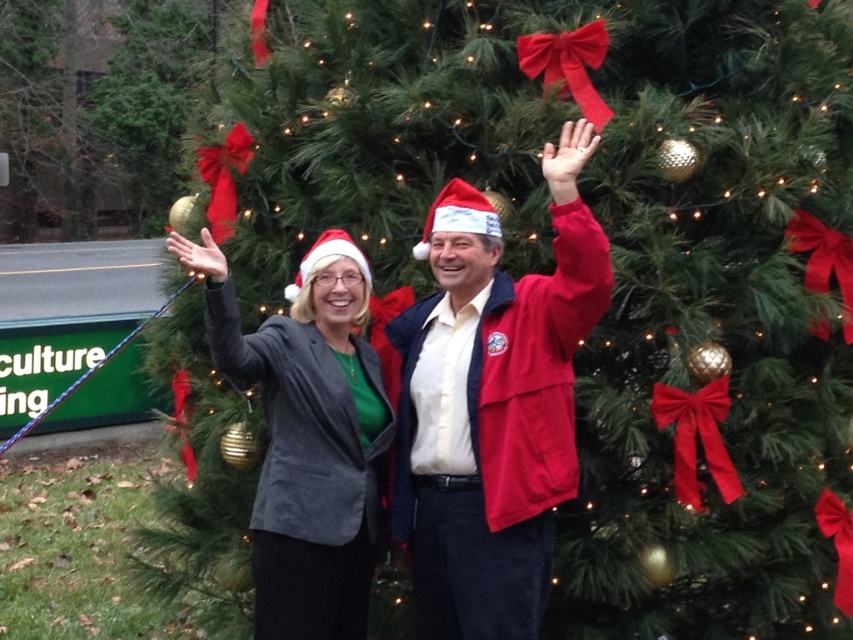
Between point (490, 525) and point (100, 88), which one is positioned in front?

Positioned in front is point (490, 525).

Is matte black blazer at center shorter than shiny gold ornament at left?

Correct, matte black blazer at center is not as tall as shiny gold ornament at left.

Where is `matte black blazer at center`? matte black blazer at center is located at coordinates (490, 404).

I want to click on matte black blazer at center, so click(490, 404).

Is matte gray blazer at center taller than shiny gold ornament at left?

No, matte gray blazer at center is not taller than shiny gold ornament at left.

Does matte gray blazer at center have a lesser height compared to shiny gold ornament at left?

Indeed, matte gray blazer at center has a lesser height compared to shiny gold ornament at left.

Image resolution: width=853 pixels, height=640 pixels. In order to click on matte gray blazer at center in this screenshot , I will do `click(306, 436)`.

Does matte black blazer at center have a smaller size compared to matte gray blazer at center?

Yes, matte black blazer at center is smaller than matte gray blazer at center.

Is point (434, 321) positioned after point (340, 588)?

Yes, it is behind point (340, 588).

Where is `matte black blazer at center`? matte black blazer at center is located at coordinates (490, 404).